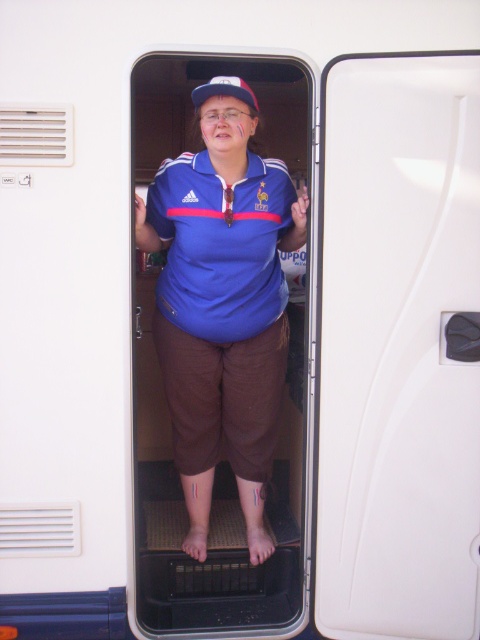
You are a delivery person trying to enter the white plastic door at center of a vehicle. The delivery box you are carrying is 2 feet wide. Can you fit through the door opening?

The white plastic door at center is 6.85 feet from viewer. The distance from the viewer to the door does not indicate the width of the door opening. Therefore, it is impossible to determine if the delivery box will fit through the door based on the provided information.

You are a photographer standing in front of the white vehicle. You notice two points marked inside the vehicle. Which of the two points, point (164,244) or point (236,81), is closer to the camera?

Point (164,244) is further to the camera than point (236,81), so the point closer to the camera is point (236,81).

You are a photographer standing at the front of the white vehicle. You want to take a photo of the blue matte polo shirt at center. Where should you position your camera to capture the shirt clearly?

The blue matte polo shirt at center is located at point (220, 244), so position the camera directly facing that coordinate to capture it clearly.